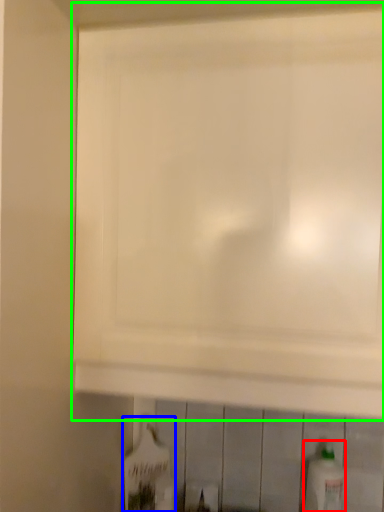
Question: Considering the real-world distances, which object is farthest from bottle (highlighted by a red box)? bottle (highlighted by a blue box) or cabinetry (highlighted by a green box)?

Choices:
 (A) bottle
 (B) cabinetry

Answer: (B)